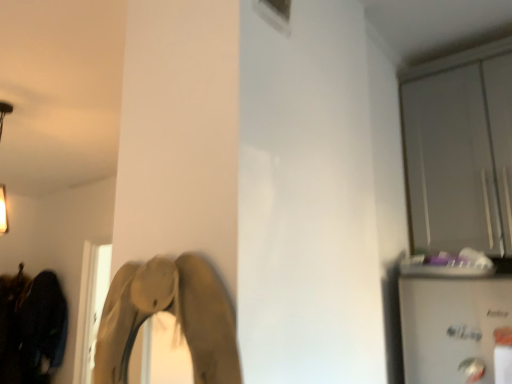
Describe the element at coordinates (458, 151) in the screenshot. The image size is (512, 384). I see `matte gray cabinet at upper right` at that location.

Find the location of a particular element. Image resolution: width=512 pixels, height=384 pixels. matte gray cabinet at upper right is located at coordinates (458, 151).

Find the location of `matte gray cabinet at upper right`. matte gray cabinet at upper right is located at coordinates (458, 151).